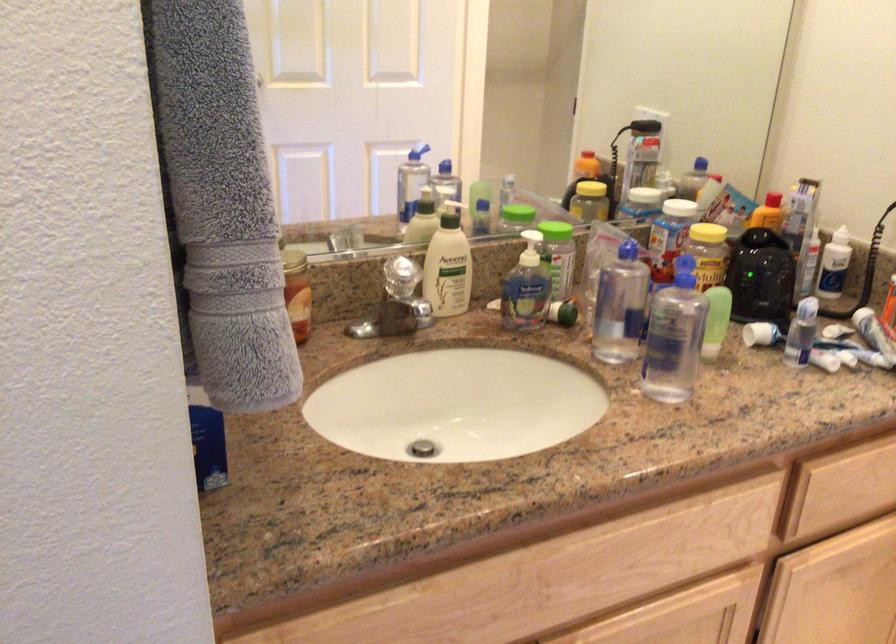
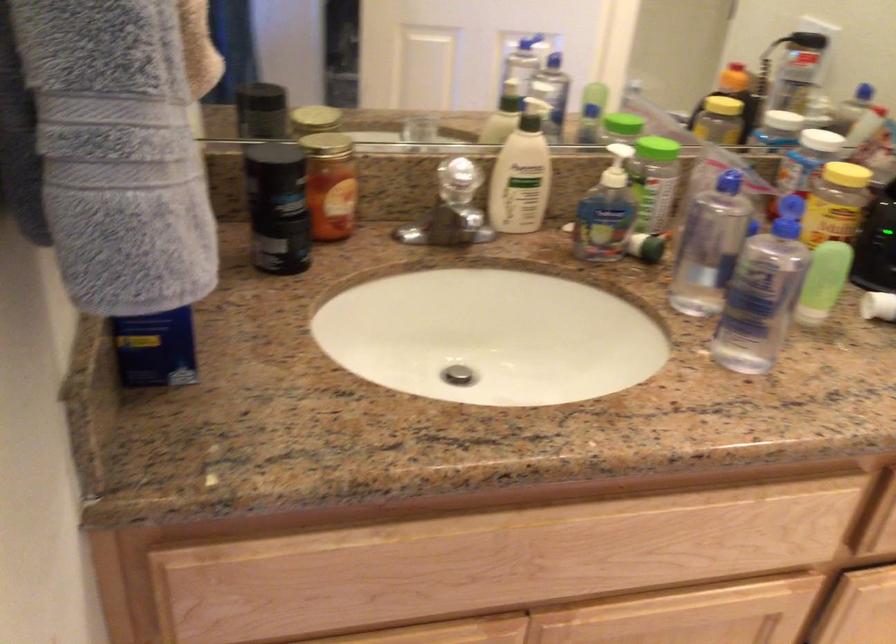
The images are taken continuously from a first-person perspective. In which direction are you moving?

The movement direction of the cameraman is right, forward.